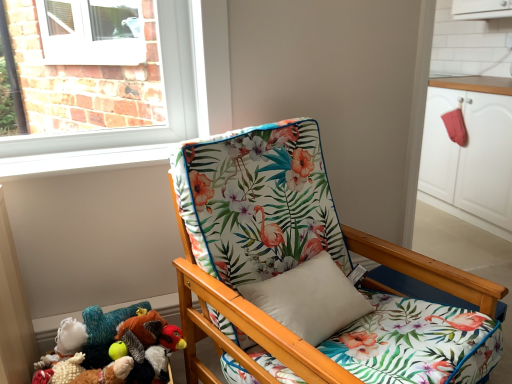
Question: In terms of width, does white matte cabinet at right look wider or thinner when compared to floral fabric chair at center?

Choices:
 (A) wide
 (B) thin

Answer: (B)

Question: From a real-world perspective, relative to floral fabric chair at center, is white matte cabinet at right vertically above or below?

Choices:
 (A) above
 (B) below

Answer: (A)

Question: Considering the real-world distances, which object is farthest from the floral fabric chair at center?

Choices:
 (A) fluffy white stuffed animal at lower left, placed as the second toy when sorted from right to left
 (B) fluffy plush toy at lower left, marked as the 1th toy in a right-to-left arrangement
 (C) white matte cabinet at right

Answer: (C)

Question: Estimate the real-world distances between objects in this image. Which object is closer to the fluffy plush toy at lower left, the 2th toy from the left?

Choices:
 (A) fluffy white stuffed animal at lower left, marked as the first toy in a left-to-right arrangement
 (B) white matte cabinet at right
 (C) floral fabric chair at center

Answer: (A)